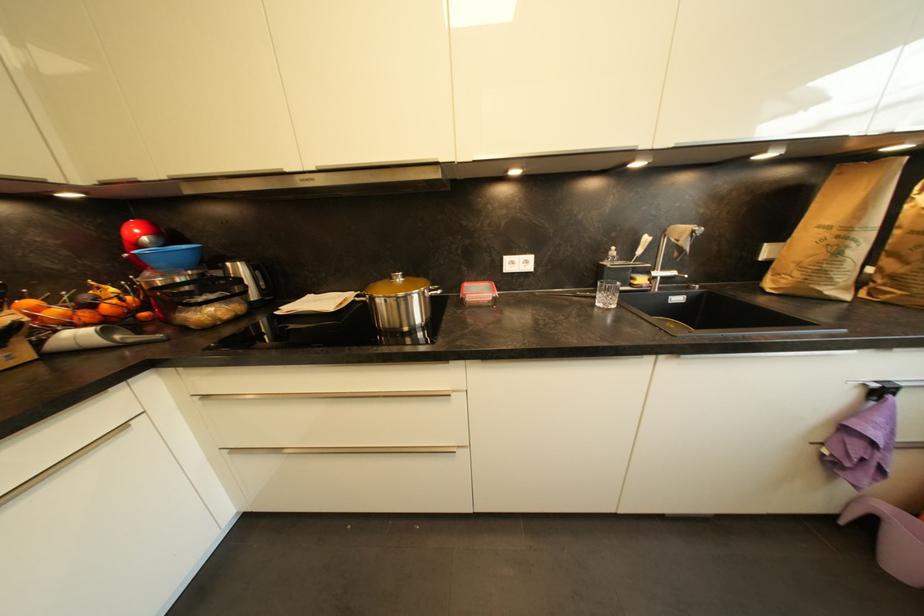
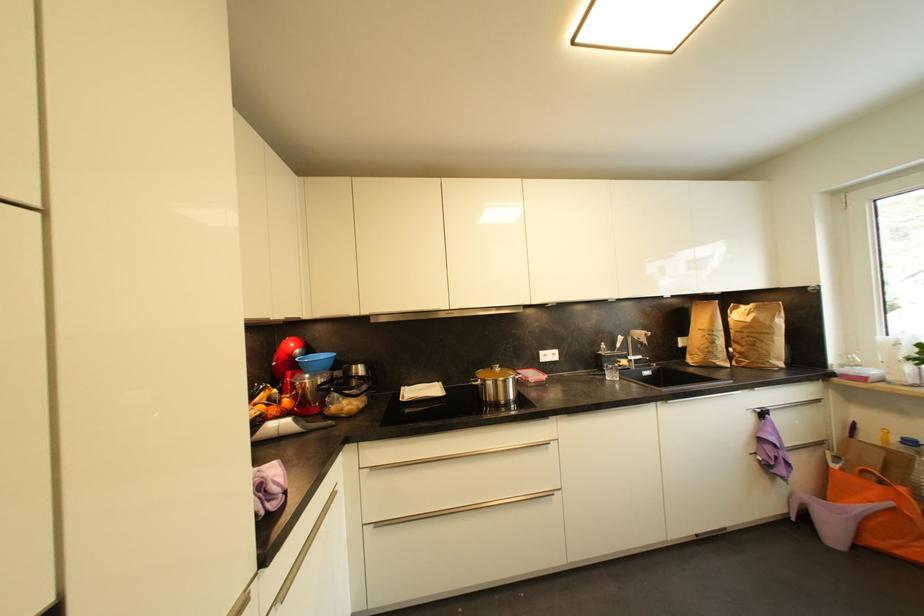
Where in the second image is the point corresponding to [610,302] from the first image?

(616, 378)